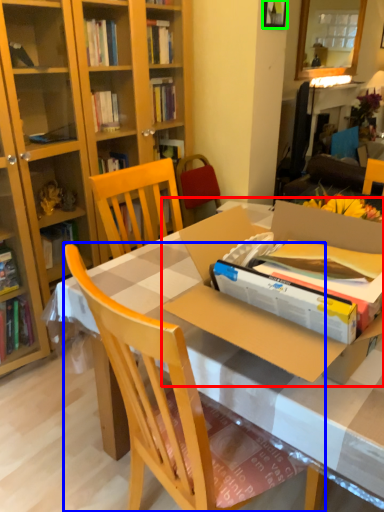
Question: Which object is positioned closest to cardboard box (highlighted by a red box)? Select from chair (highlighted by a blue box) and picture frame (highlighted by a green box).

Choices:
 (A) chair
 (B) picture frame

Answer: (A)